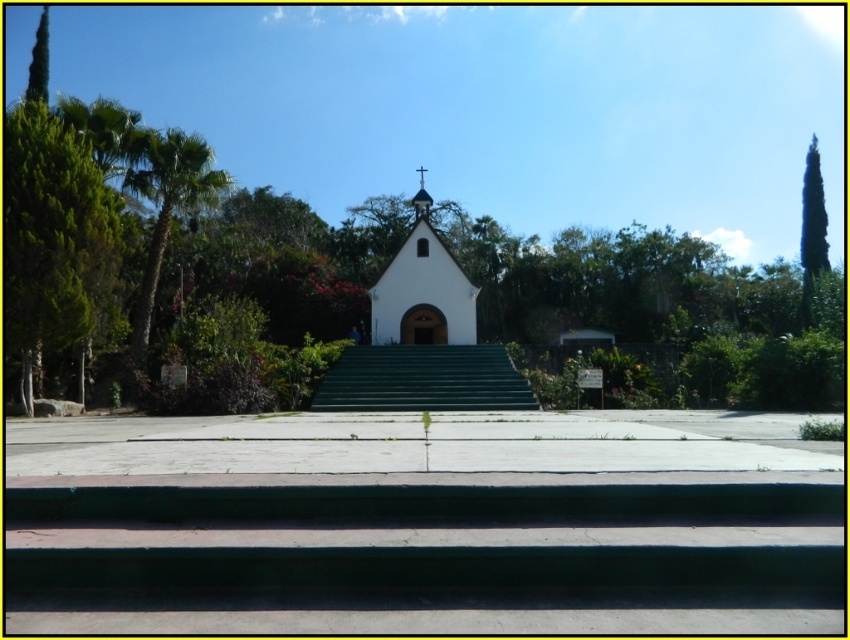
You are standing at the base of the green concrete stairs at center, and you want to take a photo of the chapel from a distance of exactly 80 feet. Can you move backward to achieve this? Explain your reasoning.

The distance between you and the camera is 81.30 feet. Since you need to be exactly 80 feet away, you should move forward slightly to reduce the distance by 1.30 feet.

You are standing at the entrance of the small white chapel and want to know the exact position of the concrete steps at center in the image. What are their coordinates?

The concrete steps at center are located at coordinates point (425, 538).

You are a visitor approaching the chapel and need to reach the entrance. You see the green concrete stairs at center and the metallic cross at upper center. Which object is closer to you as you approach the entrance?

The green concrete stairs at center is closer to you than the metallic cross at upper center because the stairs are shorter in height compared to the cross.